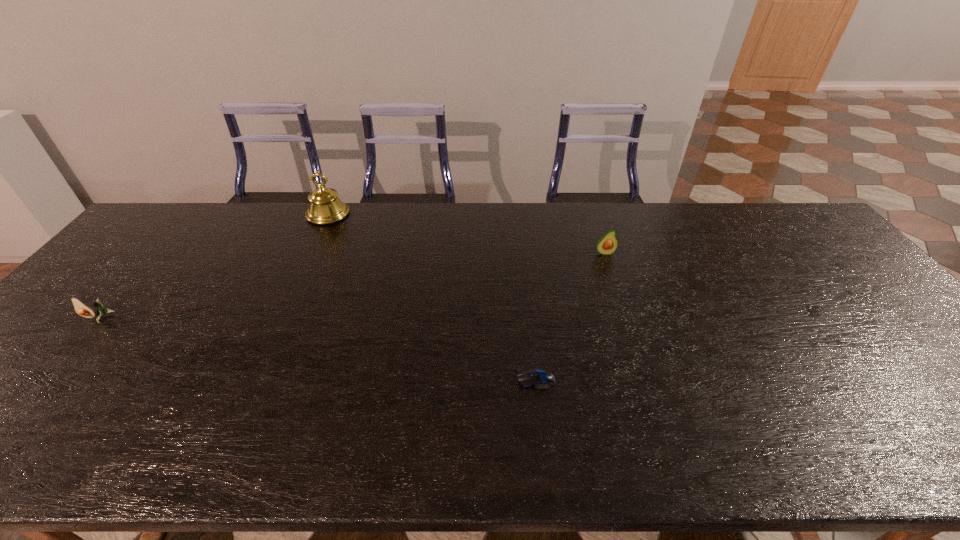
Locate an element on the screen. free spot located 0.200m on the seed side of the leftmost object is located at coordinates (36, 389).

Locate an element on the screen. Image resolution: width=960 pixels, height=540 pixels. vacant space located on the button side of the computer mouse is located at coordinates (423, 380).

Where is `vacant region located on the button side of the computer mouse`? Image resolution: width=960 pixels, height=540 pixels. vacant region located on the button side of the computer mouse is located at coordinates (406, 380).

You are a GUI agent. You are given a task and a screenshot of the screen. Output one action in this format:
    pyautogui.click(x=<x>, y=<y>)
    Task: Click on the vacant region located on the button side of the computer mouse
    The height and width of the screenshot is (540, 960).
    Given the screenshot: What is the action you would take?
    pyautogui.click(x=406, y=380)

Locate an element on the screen. This screenshot has height=540, width=960. object that is at the far edge is located at coordinates (325, 207).

This screenshot has height=540, width=960. Identify the location of object located in the left edge section of the desktop. (82, 307).

Locate an element on the screen. The height and width of the screenshot is (540, 960). free location at the far edge of the desktop is located at coordinates (567, 209).

The height and width of the screenshot is (540, 960). In the image, there is a desktop. In order to click on free space at the near edge in this screenshot , I will do `click(351, 443)`.

Find the location of `vacant space at the left edge`. vacant space at the left edge is located at coordinates (12, 417).

Where is `vacant space at the right edge of the desktop`? This screenshot has width=960, height=540. vacant space at the right edge of the desktop is located at coordinates (953, 382).